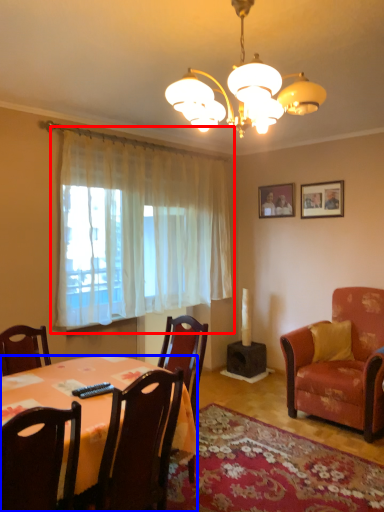
Question: Among these objects, which one is nearest to the camera, curtain (highlighted by a red box) or kitchen & dining room table (highlighted by a blue box)?

Choices:
 (A) curtain
 (B) kitchen & dining room table

Answer: (B)